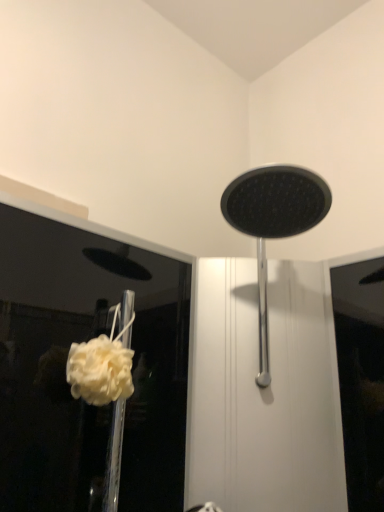
Question: Based on their sizes in the image, would you say polished chrome shower head at center is bigger or smaller than white fluffy sponge at lower left?

Choices:
 (A) big
 (B) small

Answer: (A)

Question: Considering the positions of polished chrome shower head at center and white fluffy sponge at lower left in the image, is polished chrome shower head at center taller or shorter than white fluffy sponge at lower left?

Choices:
 (A) tall
 (B) short

Answer: (A)

Question: Is point (322, 215) positioned closer to the camera than point (84, 355)?

Choices:
 (A) farther
 (B) closer

Answer: (A)

Question: In the image, is white fluffy sponge at lower left positioned in front of or behind polished chrome shower head at center?

Choices:
 (A) front
 (B) behind

Answer: (B)

Question: From a real-world perspective, is white fluffy sponge at lower left above or below polished chrome shower head at center?

Choices:
 (A) below
 (B) above

Answer: (A)

Question: Based on their sizes in the image, would you say white fluffy sponge at lower left is bigger or smaller than polished chrome shower head at center?

Choices:
 (A) big
 (B) small

Answer: (B)

Question: Is white fluffy sponge at lower left inside the boundaries of polished chrome shower head at center, or outside?

Choices:
 (A) inside
 (B) outside

Answer: (B)